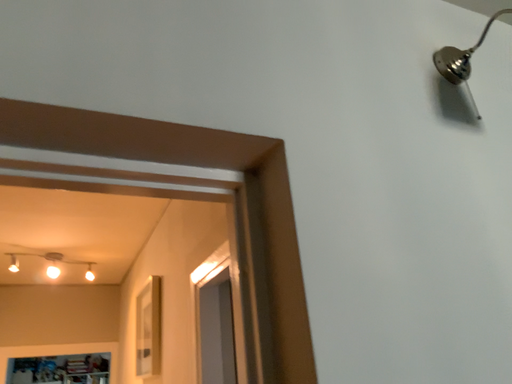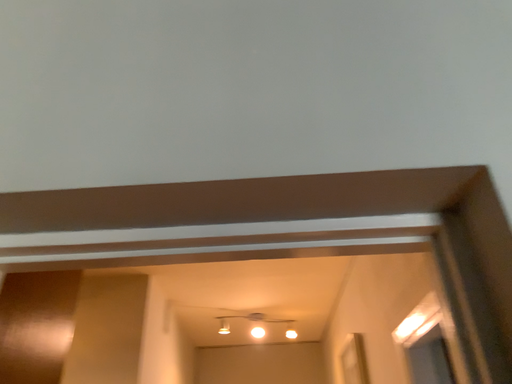
Question: Which way did the camera rotate in the video?

Choices:
 (A) rotated left
 (B) rotated right

Answer: (A)